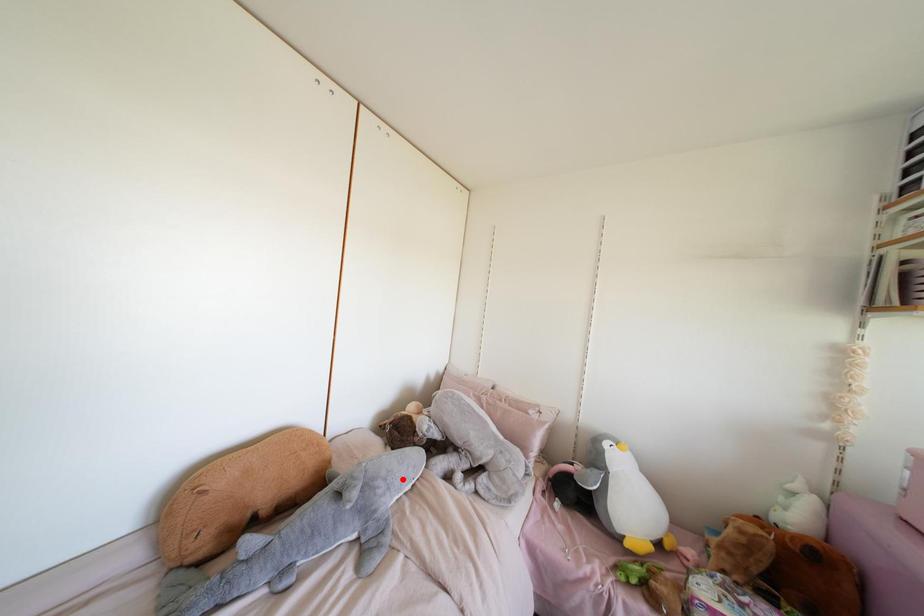
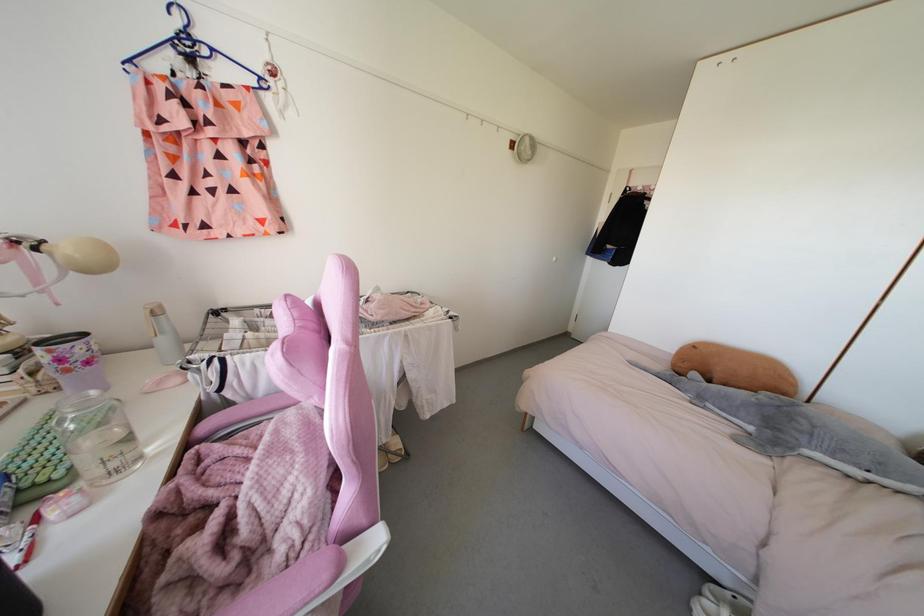
The point at the highlighted location is marked in the first image. Where is the corresponding point in the second image?

(843, 450)